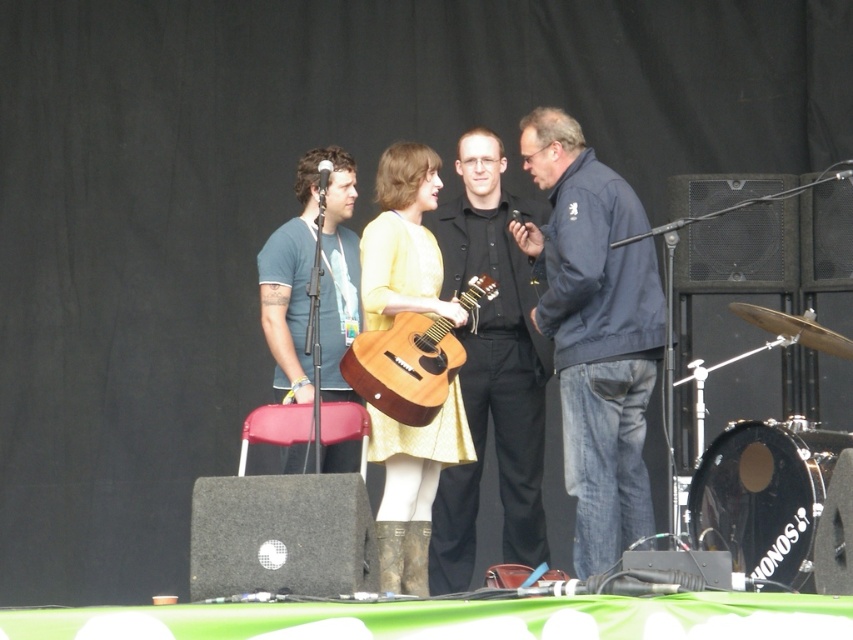
Is point (299, 388) positioned behind point (428, 362)?

Yes, it is.

Consider the image. How far apart are matte blue shirt at center and wooden acoustic guitar at center?

matte blue shirt at center and wooden acoustic guitar at center are 57.02 centimeters apart from each other.

Measure the distance between matte blue shirt at center and camera.

The distance of matte blue shirt at center from camera is 7.28 meters.

What are the coordinates of `matte blue shirt at center` in the screenshot? It's located at [x=308, y=280].

Which of these two, black matte shirt at center or wooden acoustic guitar at center, stands taller?

black matte shirt at center

Does black matte shirt at center appear over wooden acoustic guitar at center?

No, black matte shirt at center is not above wooden acoustic guitar at center.

Does point (463, 349) lie behind point (405, 403)?

Yes, it is.

Identify the location of black matte shirt at center. (491, 371).

Is matte yellow dress at center smaller than matte blue shirt at center?

Correct, matte yellow dress at center occupies less space than matte blue shirt at center.

Between point (432, 429) and point (325, 298), which one is positioned behind?

Point (325, 298)

Between point (460, 404) and point (335, 390), which one is positioned in front?

Point (460, 404)

Find the location of a particular element. The image size is (853, 640). matte yellow dress at center is located at coordinates (403, 241).